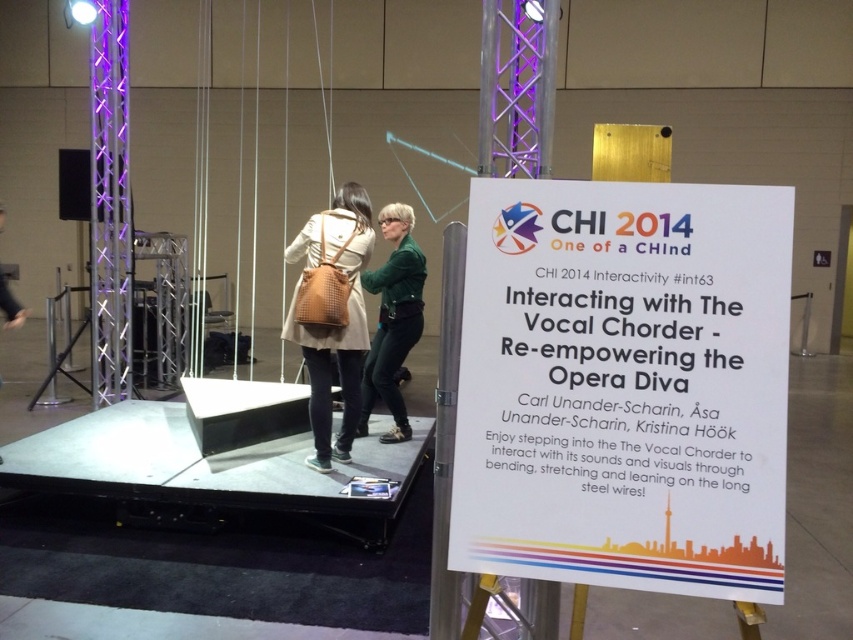
Is point (691, 589) positioned behind point (354, 420)?

No, it is in front of (354, 420).

Is point (701, 557) in front of point (351, 188)?

Yes, it is in front of point (351, 188).

Who is more distant from viewer, (749, 236) or (364, 200)?

The point (364, 200) is behind.

The height and width of the screenshot is (640, 853). Find the location of `white paper sign at center`. white paper sign at center is located at coordinates (624, 385).

Between matte brown leather backpack at center and green matte jacket at center, which one has more height?

Standing taller between the two is matte brown leather backpack at center.

Who is positioned more to the right, matte brown leather backpack at center or green matte jacket at center?

green matte jacket at center is more to the right.

Which is behind, point (347, 339) or point (368, 410)?

Point (368, 410)

The height and width of the screenshot is (640, 853). In order to click on matte brown leather backpack at center in this screenshot , I will do `click(334, 330)`.

Does point (784, 452) lie in front of point (422, 324)?

Yes, it is in front of point (422, 324).

Between point (643, 204) and point (384, 282), which one is positioned in front?

Point (643, 204) is in front.

Locate an element on the screen. white paper sign at center is located at coordinates (624, 385).